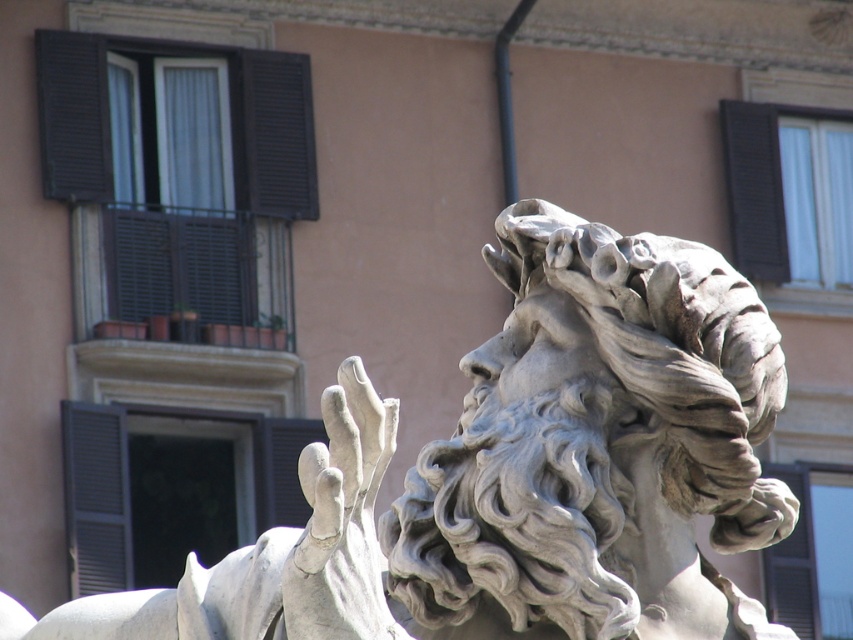
Question: Which point is farther from the camera taking this photo?

Choices:
 (A) (781, 250)
 (B) (408, 493)

Answer: (A)

Question: Does white marble statue at upper center appear under black matte shutter at upper right?

Choices:
 (A) yes
 (B) no

Answer: (A)

Question: Is white marble statue at upper center to the right of black matte shutter at upper right from the viewer's perspective?

Choices:
 (A) yes
 (B) no

Answer: (B)

Question: Which point is closer to the camera?

Choices:
 (A) (770, 276)
 (B) (735, 637)

Answer: (B)

Question: Where is white marble statue at upper center located in relation to black matte shutter at upper right in the image?

Choices:
 (A) right
 (B) left

Answer: (B)